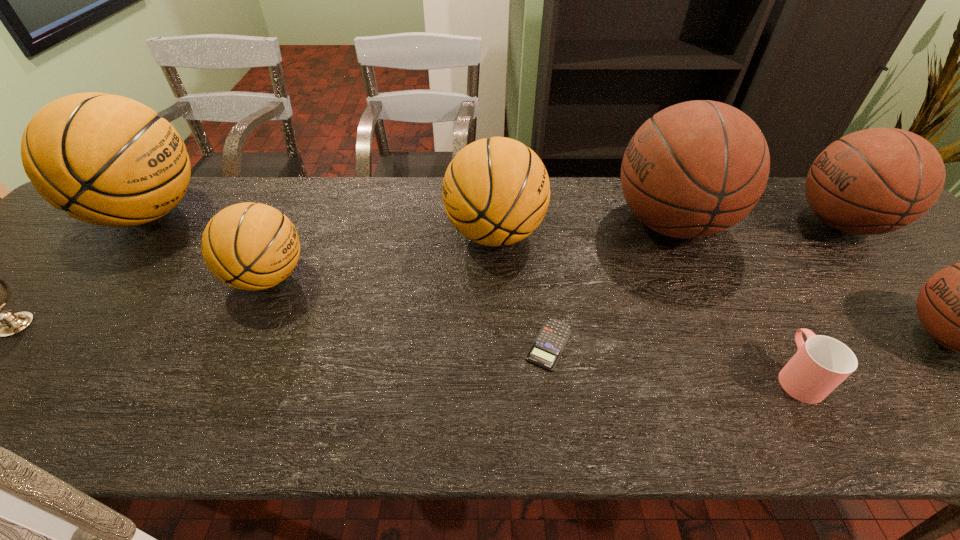
Find the location of a particular element. The height and width of the screenshot is (540, 960). the leftmost basketball is located at coordinates (108, 160).

You are a GUI agent. You are given a task and a screenshot of the screen. Output one action in this format:
    pyautogui.click(x=<x>, y=<y>)
    Task: Click on the biggest orange basketball
    Image resolution: width=960 pixels, height=540 pixels.
    Given the screenshot: What is the action you would take?
    pyautogui.click(x=108, y=160)

The image size is (960, 540). In order to click on the leftmost brown basketball in this screenshot , I will do tap(694, 169).

At what (x,y) coordinates should I click in order to perform the action: click on the biggest brown basketball. Please return your answer as a coordinate pair (x, y). The width and height of the screenshot is (960, 540). Looking at the image, I should click on (694, 169).

Identify the location of the rightmost orange basketball. The width and height of the screenshot is (960, 540). (496, 191).

The height and width of the screenshot is (540, 960). In order to click on the third basketball from left to right in this screenshot , I will do `click(496, 191)`.

This screenshot has width=960, height=540. Identify the location of the second smallest brown basketball. (878, 180).

Locate an element on the screen. The image size is (960, 540). the third object from left to right is located at coordinates pyautogui.click(x=249, y=246).

Locate an element on the screen. the second orange basketball from left to right is located at coordinates (249, 246).

Locate an element on the screen. This screenshot has height=540, width=960. the eighth tallest object is located at coordinates (820, 364).